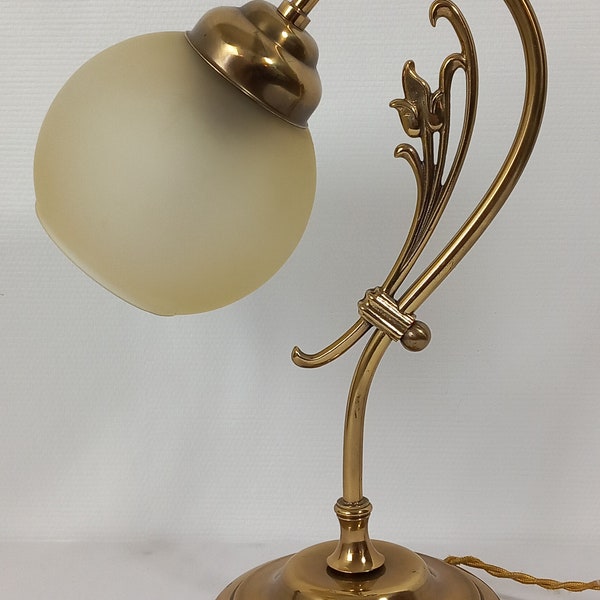
The image size is (600, 600). Find the location of `left of lamp`. left of lamp is located at coordinates (19, 206).